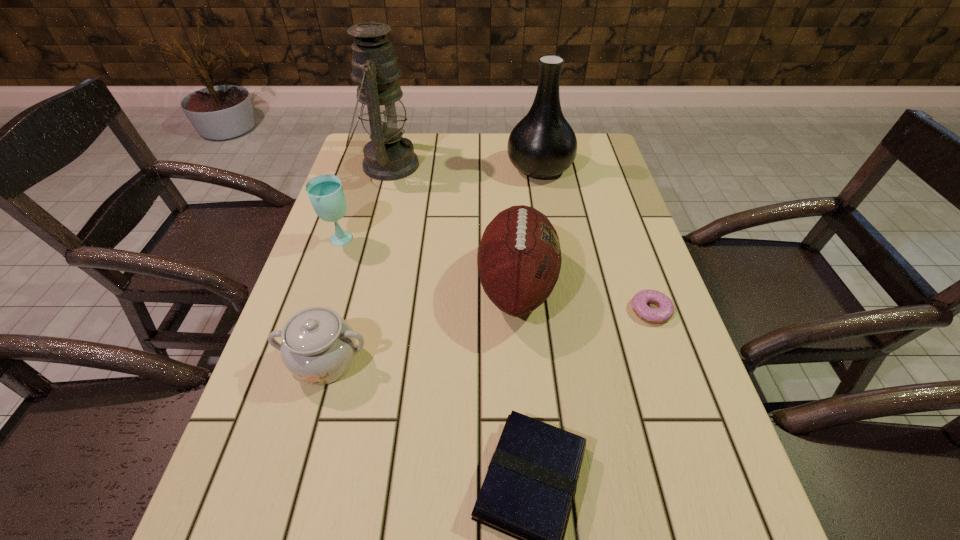
Where is `the tallest object`? The height and width of the screenshot is (540, 960). the tallest object is located at coordinates (388, 156).

Locate an element on the screen. vase is located at coordinates (543, 144).

Identify the location of football (American). The width and height of the screenshot is (960, 540). (519, 259).

Locate an element on the screen. The width and height of the screenshot is (960, 540). glass is located at coordinates (325, 192).

The image size is (960, 540). I want to click on chinaware, so click(x=318, y=346).

In order to click on the rightmost object in this screenshot , I will do (x=665, y=311).

You are a GUI agent. You are given a task and a screenshot of the screen. Output one action in this format:
    pyautogui.click(x=<x>, y=<y>)
    Task: Click on the doughnut
    
    Given the screenshot: What is the action you would take?
    pyautogui.click(x=665, y=311)

Identify the location of free space located 0.390m on the right of the oil lamp. (543, 165).

Where is `vacant space located 0.080m on the left of the vase`? The width and height of the screenshot is (960, 540). vacant space located 0.080m on the left of the vase is located at coordinates (481, 168).

Where is `vacant region located on the right of the football (American)`? The image size is (960, 540). vacant region located on the right of the football (American) is located at coordinates (599, 286).